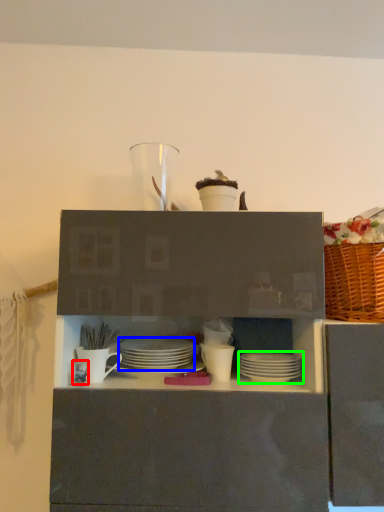
Question: Estimate the real-world distances between objects in this image. Which object is closer to tableware (highlighted by a red box), tableware (highlighted by a blue box) or tableware (highlighted by a green box)?

Choices:
 (A) tableware
 (B) tableware

Answer: (A)